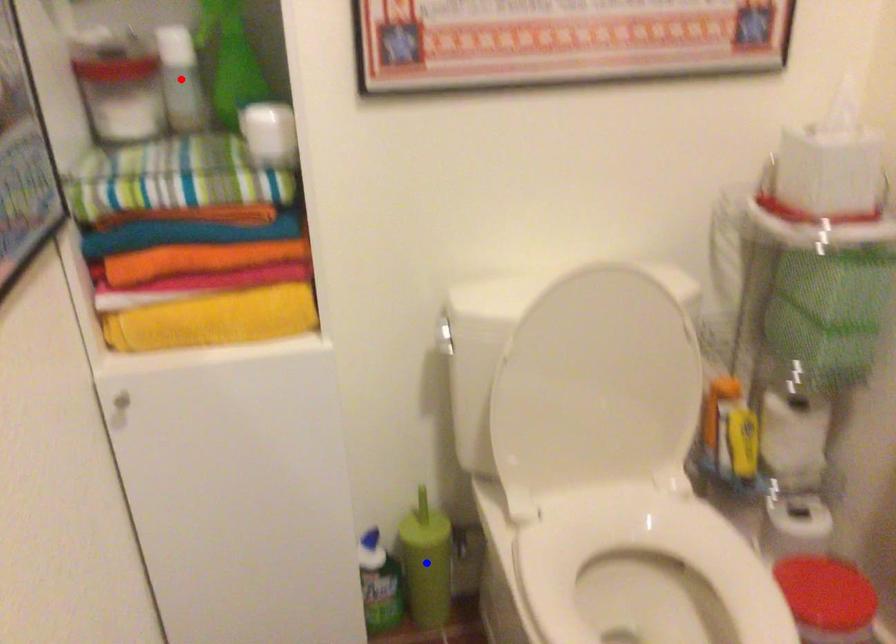
Question: In the image, two points are highlighted. Which point is nearer to the camera? Reply with the corresponding letter.

Choices:
 (A) blue point
 (B) red point

Answer: (B)